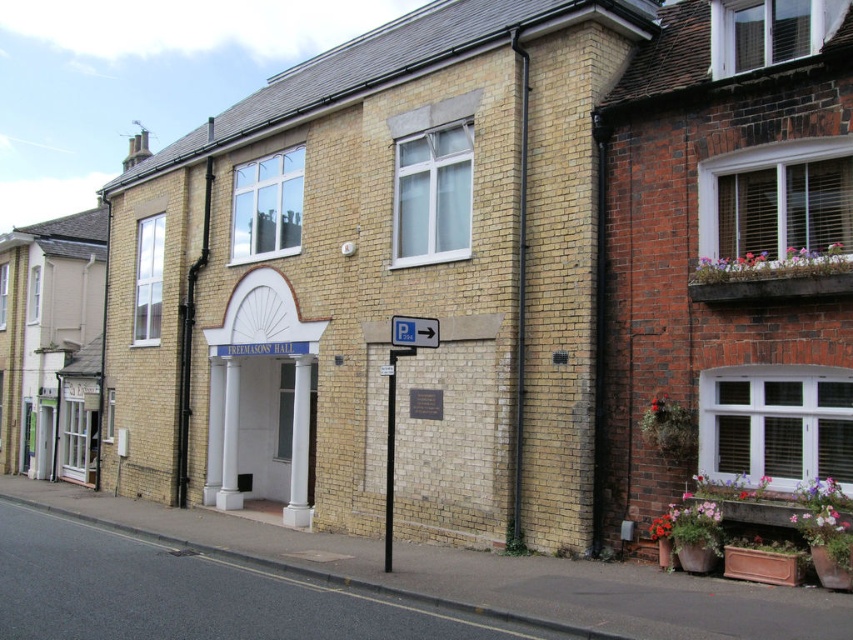
Question: Is smooth black pole at center smaller than white plastic sign at center?

Choices:
 (A) yes
 (B) no

Answer: (B)

Question: Is smooth black pole at center above white plastic sign at center?

Choices:
 (A) yes
 (B) no

Answer: (B)

Question: Which point appears closest to the camera in this image?

Choices:
 (A) (387, 545)
 (B) (397, 337)

Answer: (A)

Question: Which point is farther to the camera?

Choices:
 (A) white plastic sign at center
 (B) smooth black pole at center

Answer: (B)

Question: Is smooth black pole at center bigger than white plastic sign at center?

Choices:
 (A) no
 (B) yes

Answer: (B)